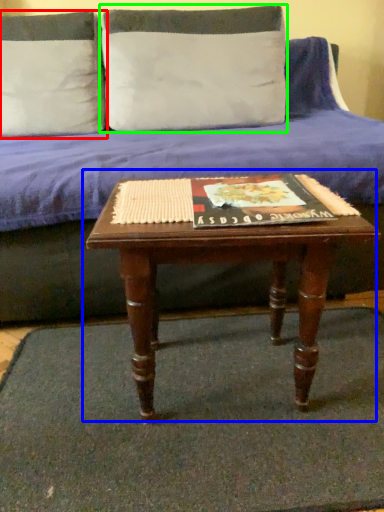
Question: Which is nearer to the pillow (highlighted by a red box)? coffee table (highlighted by a blue box) or pillow (highlighted by a green box).

Choices:
 (A) coffee table
 (B) pillow

Answer: (B)